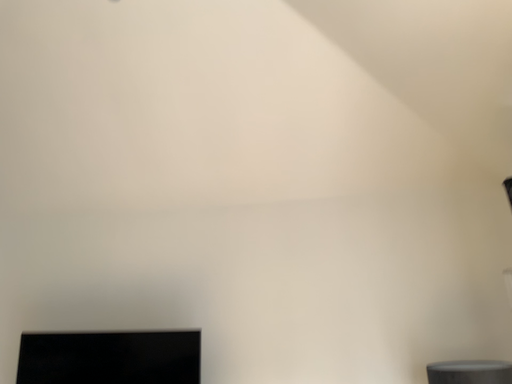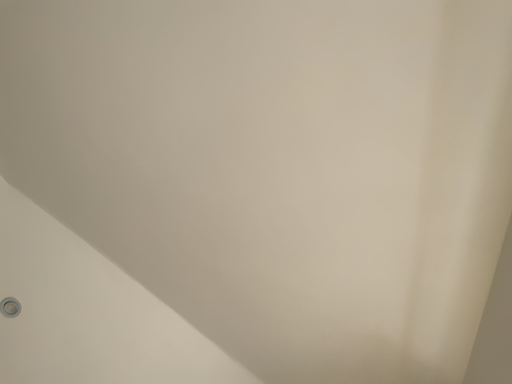
Question: Which way did the camera rotate in the video?

Choices:
 (A) rotated left
 (B) rotated right

Answer: (B)